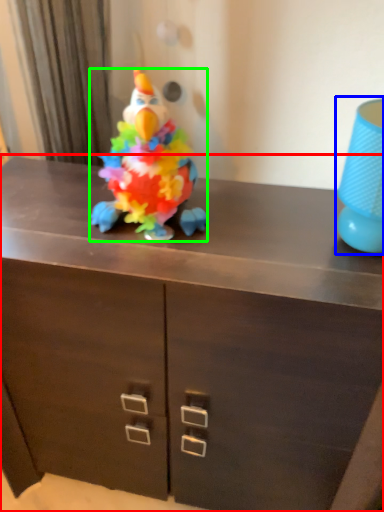
Question: Which is nearer to the chest of drawers (highlighted by a red box)? lamp (highlighted by a blue box) or toy (highlighted by a green box).

Choices:
 (A) lamp
 (B) toy

Answer: (B)